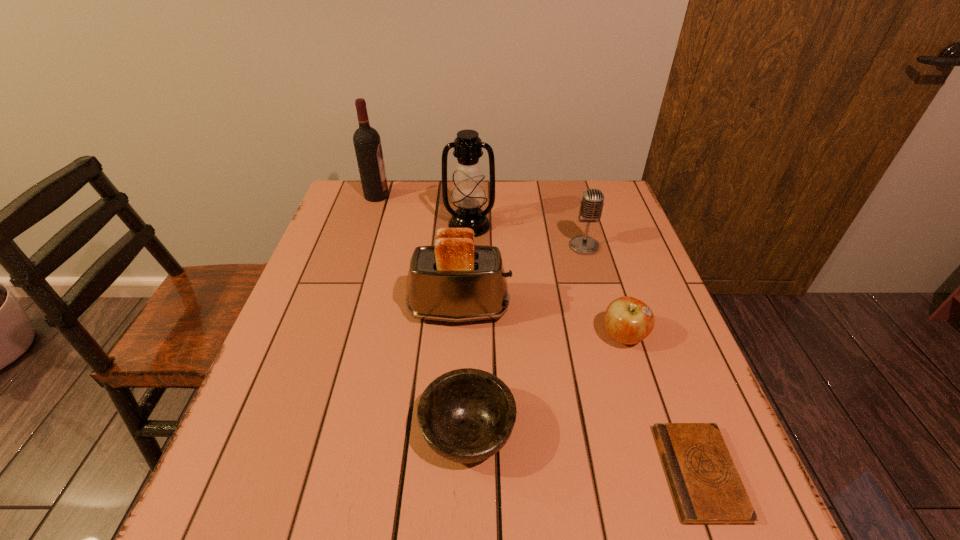
Find the location of a particular element. The image size is (960, 540). vacant area situated 0.380m on the side of the toaster with the control lever is located at coordinates (671, 309).

The height and width of the screenshot is (540, 960). Find the location of `vacant area located on the left of the fourth shortest object`. vacant area located on the left of the fourth shortest object is located at coordinates (446, 246).

The height and width of the screenshot is (540, 960). In order to click on vacant space located on the front of the apple in this screenshot , I will do `click(646, 409)`.

Find the location of `free space located 0.220m on the left of the bowl`. free space located 0.220m on the left of the bowl is located at coordinates (301, 433).

This screenshot has height=540, width=960. Identify the location of free space located on the spine side of the shortest object. (439, 473).

Find the location of `free space located on the spine side of the shortest object`. free space located on the spine side of the shortest object is located at coordinates [450, 473].

Locate an element on the screen. vacant position located 0.270m on the spine side of the shortest object is located at coordinates (509, 473).

I want to click on wine bottle that is at the far edge, so click(367, 143).

Where is `oil lamp that is at the far edge`? The image size is (960, 540). oil lamp that is at the far edge is located at coordinates (468, 192).

Find the location of a particular element. object at the near edge is located at coordinates (707, 488).